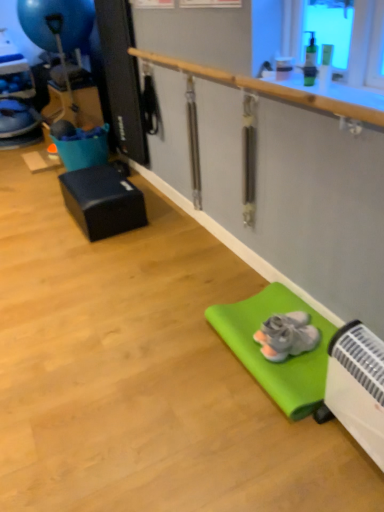
What do you see at coordinates (57, 22) in the screenshot? The width and height of the screenshot is (384, 512). I see `blue rubber balloon at upper left` at bounding box center [57, 22].

Measure the distance between black matte cube at left and camera.

black matte cube at left and camera are 2.56 meters apart from each other.

Describe the element at coordinates (103, 201) in the screenshot. I see `black matte cube at left` at that location.

This screenshot has height=512, width=384. In order to click on green rubber yoga mat at lower right in this screenshot , I will do `click(268, 360)`.

This screenshot has width=384, height=512. In order to click on gray suede sneakers at lower right in this screenshot , I will do `click(286, 335)`.

Is wooden rail at upper center directly adjacent to green rubber yoga mat at lower right?

No, wooden rail at upper center is not beside green rubber yoga mat at lower right.

In the scene shown: Is wooden rail at upper center at the right side of green rubber yoga mat at lower right?

No, wooden rail at upper center is not to the right of green rubber yoga mat at lower right.

Does point (272, 94) lie in front of point (301, 389)?

No, (272, 94) is behind (301, 389).

Between wooden rail at upper center and green rubber yoga mat at lower right, which one is positioned behind?

green rubber yoga mat at lower right is behind.

From the image's perspective, would you say green rubber yoga mat at lower right is shown under blue rubber balloon at upper left?

Correct, green rubber yoga mat at lower right appears lower than blue rubber balloon at upper left in the image.

From a real-world perspective, relative to blue rubber balloon at upper left, is green rubber yoga mat at lower right vertically above or below?

green rubber yoga mat at lower right is below blue rubber balloon at upper left.

Which object is positioned more to the left, green rubber yoga mat at lower right or blue rubber balloon at upper left?

blue rubber balloon at upper left is more to the left.

Locate an element on the screen. furniture above the gray suede sneakers at lower right (from the image's perspective) is located at coordinates (103, 201).

Who is smaller, gray suede sneakers at lower right or black matte cube at left?

gray suede sneakers at lower right.

From a real-world perspective, who is located higher, gray suede sneakers at lower right or black matte cube at left?

From a 3D spatial view, black matte cube at left is above.

Is gray suede sneakers at lower right at the left side of black matte cube at left?

No, gray suede sneakers at lower right is not to the left of black matte cube at left.

Relative to black matte cube at left, is wooden rail at upper center in front or behind?

Visually, wooden rail at upper center is located in front of black matte cube at left.

Based on the photo, in terms of width, does wooden rail at upper center look wider or thinner when compared to black matte cube at left?

Considering their sizes, wooden rail at upper center looks slimmer than black matte cube at left.

Can you confirm if wooden rail at upper center is bigger than black matte cube at left?

No.

Can you confirm if wooden rail at upper center is positioned to the right of black matte cube at left?

Yes, wooden rail at upper center is to the right of black matte cube at left.

Is green rubber yoga mat at lower right oriented towards gray suede sneakers at lower right?

No, green rubber yoga mat at lower right is not turned towards gray suede sneakers at lower right.

Would you say green rubber yoga mat at lower right is inside or outside gray suede sneakers at lower right?

green rubber yoga mat at lower right is outside gray suede sneakers at lower right.

Considering their positions, is green rubber yoga mat at lower right located in front of or behind gray suede sneakers at lower right?

green rubber yoga mat at lower right is positioned closer to the viewer than gray suede sneakers at lower right.

What's the angular difference between green rubber yoga mat at lower right and gray suede sneakers at lower right's facing directions?

There is a 7.15-degree angle between the facing directions of green rubber yoga mat at lower right and gray suede sneakers at lower right.

Between blue rubber balloon at upper left and gray suede sneakers at lower right, which one has smaller size?

With smaller size is gray suede sneakers at lower right.

Considering the positions of objects blue rubber balloon at upper left and gray suede sneakers at lower right in the image provided, who is behind, blue rubber balloon at upper left or gray suede sneakers at lower right?

blue rubber balloon at upper left is further from the camera.

Is blue rubber balloon at upper left next to gray suede sneakers at lower right and touching it?

No, blue rubber balloon at upper left is not in contact with gray suede sneakers at lower right.

Would you say gray suede sneakers at lower right is part of blue rubber balloon at upper left's contents?

No, blue rubber balloon at upper left does not contain gray suede sneakers at lower right.

Is gray suede sneakers at lower right completely or partially outside of wooden rail at upper center?

gray suede sneakers at lower right lies outside wooden rail at upper center's area.

Is gray suede sneakers at lower right aimed at wooden rail at upper center?

No, gray suede sneakers at lower right does not turn towards wooden rail at upper center.

Can you tell me how much gray suede sneakers at lower right and wooden rail at upper center differ in facing direction?

6.87 degrees.

Find the location of `rail above the green rubber yoga mat at lower right (from a real-world perspective)`. rail above the green rubber yoga mat at lower right (from a real-world perspective) is located at coordinates (267, 88).

The image size is (384, 512). Find the location of `balloon that is behind the green rubber yoga mat at lower right`. balloon that is behind the green rubber yoga mat at lower right is located at coordinates (57, 22).

Based on their spatial positions, is wooden rail at upper center or gray suede sneakers at lower right closer to blue rubber balloon at upper left?

wooden rail at upper center lies closer to blue rubber balloon at upper left than the other object.

Based on their spatial positions, is green rubber yoga mat at lower right or black matte cube at left closer to wooden rail at upper center?

green rubber yoga mat at lower right lies closer to wooden rail at upper center than the other object.

Considering their positions, is green rubber yoga mat at lower right positioned further to blue rubber balloon at upper left than gray suede sneakers at lower right?

gray suede sneakers at lower right lies further to blue rubber balloon at upper left than the other object.

Which object lies further to the anchor point blue rubber balloon at upper left, black matte cube at left or green rubber yoga mat at lower right?

green rubber yoga mat at lower right.

Based on their spatial positions, is wooden rail at upper center or black matte cube at left closer to gray suede sneakers at lower right?

wooden rail at upper center is closer to gray suede sneakers at lower right.

Estimate the real-world distances between objects in this image. Which object is further from gray suede sneakers at lower right, green rubber yoga mat at lower right or black matte cube at left?

Based on the image, black matte cube at left appears to be further to gray suede sneakers at lower right.

Based on the photo, considering their positions, is black matte cube at left positioned closer to wooden rail at upper center than green rubber yoga mat at lower right?

The object closer to wooden rail at upper center is green rubber yoga mat at lower right.

Based on the photo, looking at the image, which one is located closer to blue rubber balloon at upper left, black matte cube at left or gray suede sneakers at lower right?

black matte cube at left is positioned closer to the anchor blue rubber balloon at upper left.

Where is `rail that lies between blue rubber balloon at upper left and green rubber yoga mat at lower right from top to bottom`? rail that lies between blue rubber balloon at upper left and green rubber yoga mat at lower right from top to bottom is located at coordinates pyautogui.click(x=267, y=88).

The height and width of the screenshot is (512, 384). Identify the location of yoga mat between black matte cube at left and gray suede sneakers at lower right. (268, 360).

Where is `rail between blue rubber balloon at upper left and gray suede sneakers at lower right in the up-down direction`? This screenshot has width=384, height=512. rail between blue rubber balloon at upper left and gray suede sneakers at lower right in the up-down direction is located at coordinates (267, 88).

The height and width of the screenshot is (512, 384). I want to click on yoga mat between wooden rail at upper center and black matte cube at left in the front-back direction, so click(268, 360).